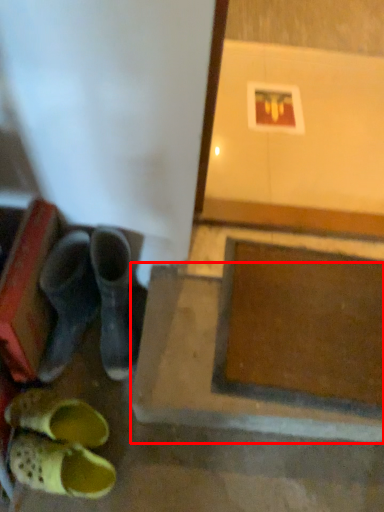
Question: From the image's perspective, where is concrete (annotated by the red box) located in relation to footwear in the image?

Choices:
 (A) below
 (B) above

Answer: (B)